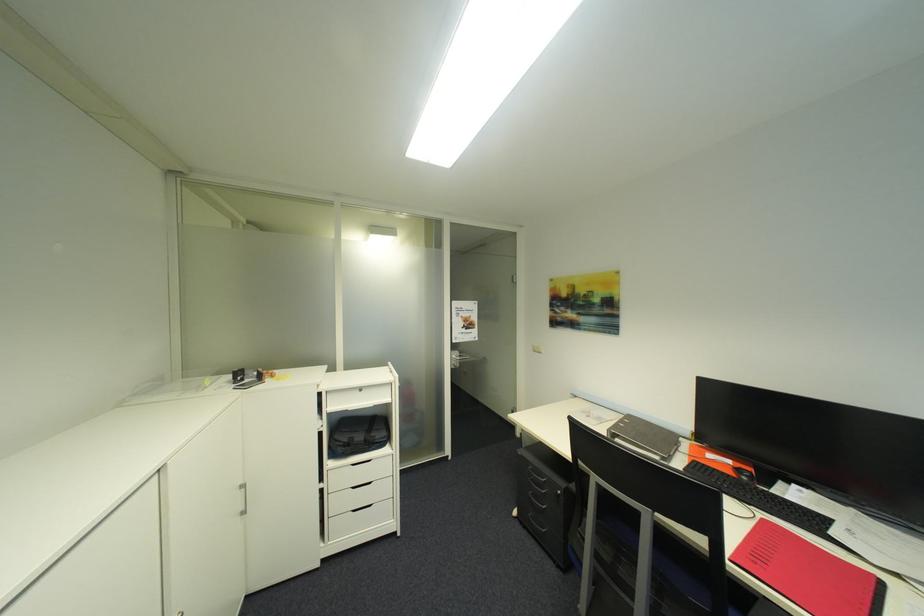
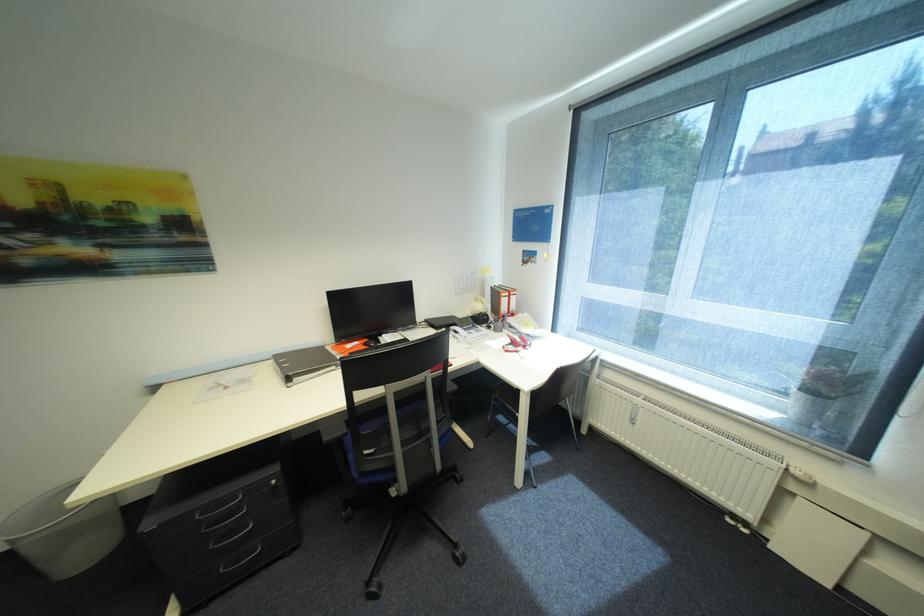
In the scene shown: The first image is from the beginning of the video and the second image is from the end. How did the camera likely rotate when shooting the video?

Answer: The camera's rotation is toward right-down.